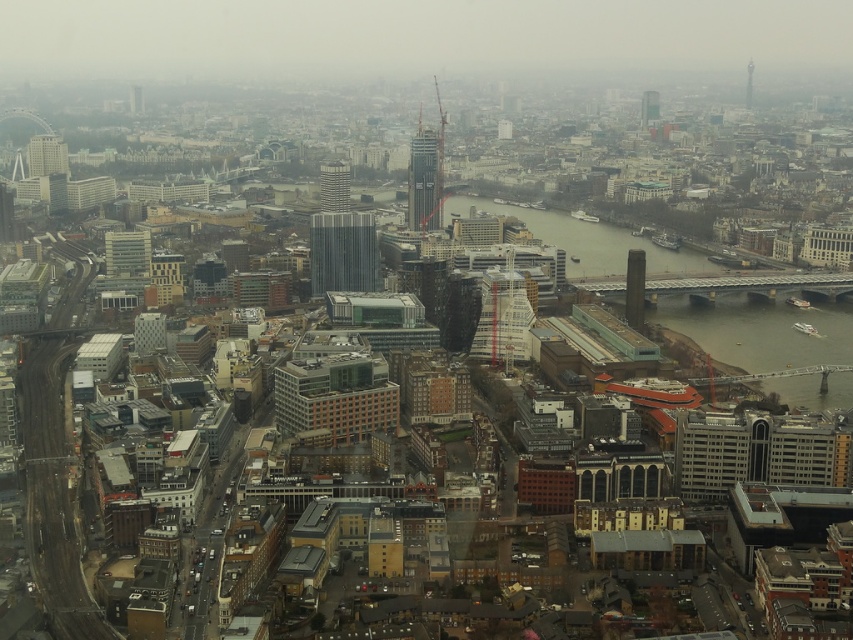
Does glassy modern skyscraper at upper right have a lesser height compared to shiny metallic tower at upper right?

Yes, glassy modern skyscraper at upper right is shorter than shiny metallic tower at upper right.

Who is positioned more to the left, glassy modern skyscraper at upper right or shiny metallic tower at upper right?

From the viewer's perspective, glassy modern skyscraper at upper right appears more on the left side.

Describe the element at coordinates (648, 108) in the screenshot. I see `glassy modern skyscraper at upper right` at that location.

I want to click on glassy modern skyscraper at upper right, so click(648, 108).

Can you confirm if metallic glass skyscraper at center is thinner than glassy reflective skyscraper at center?

Yes, metallic glass skyscraper at center is thinner than glassy reflective skyscraper at center.

Between metallic glass skyscraper at center and glassy reflective skyscraper at center, which one is positioned lower?

metallic glass skyscraper at center

Which is in front, point (363, 264) or point (321, 170)?

Point (363, 264)

Where is `metallic glass skyscraper at center`? This screenshot has height=640, width=853. metallic glass skyscraper at center is located at coordinates coord(341,252).

Is glassy steel tower at center further to camera compared to glassy reflective skyscraper at center?

No.

Locate an element on the screen. The image size is (853, 640). glassy steel tower at center is located at coordinates (425, 180).